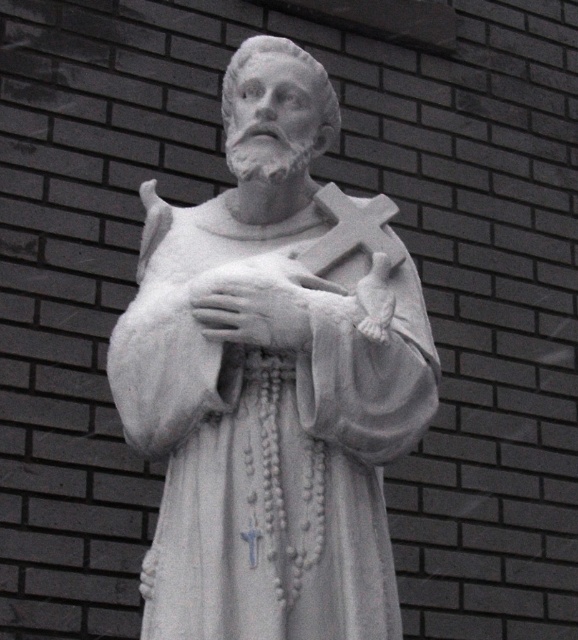
You are a sculptor who needs to move a 1.5 meter wide sculpture from the storage to the garden. The garden has a narrow pathway that is only 1.6 meters wide. You want to move the sculpture through the pathway between the white marble statue at center and the white stone cross at center. Will the sculpture fit through the pathway?

The distance between the white marble statue at center and the white stone cross at center is 1.73 meters. Since the sculpture is 1.5 meters wide, it will fit through the pathway as the available space is wider than the sculpture.

What is located at the point with coordinates (272, 378) in the image?

The white marble statue at center is located at point (272, 378).